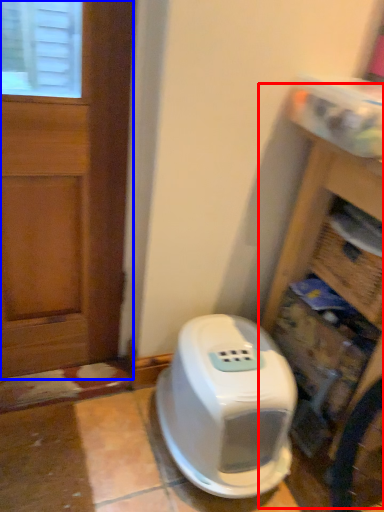
Question: Which object appears closest to the camera in this image, bookshelf (highlighted by a red box) or door (highlighted by a blue box)?

Choices:
 (A) bookshelf
 (B) door

Answer: (A)